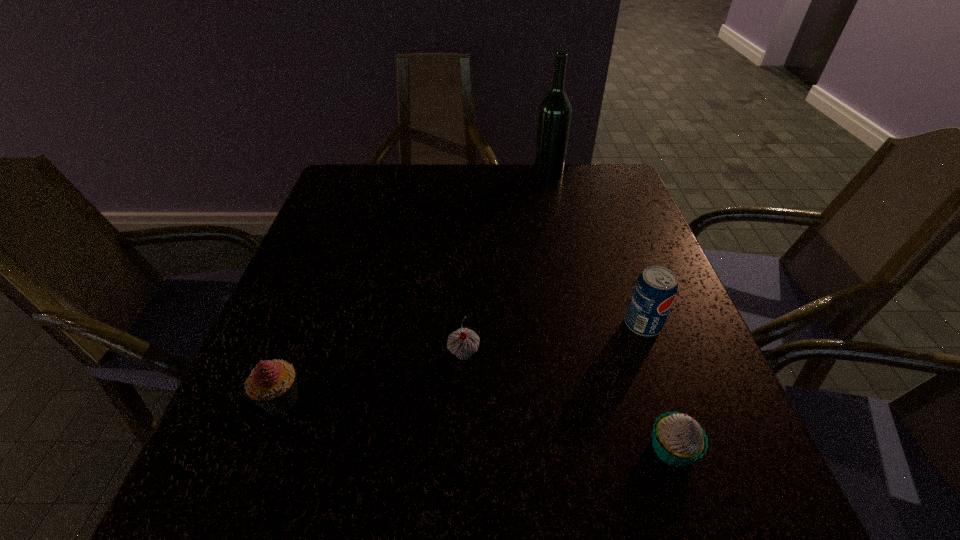
I want to click on object present at the near right corner, so click(678, 439).

Where is `free region at the far edge of the desktop`? Image resolution: width=960 pixels, height=540 pixels. free region at the far edge of the desktop is located at coordinates (405, 208).

I want to click on free space at the near edge of the desktop, so click(x=608, y=469).

In the image, there is a desktop. Identify the location of vacant space at the left edge. (373, 212).

In the image, there is a desktop. Identify the location of vacant space at the right edge. (744, 450).

Find the location of a particular element. This screenshot has width=960, height=540. vacant space at the far right corner of the desktop is located at coordinates (576, 198).

Identify the location of free space between the farthest object and the leftmost cupcake. This screenshot has height=540, width=960. (415, 285).

Locate an element on the screen. free area in between the nearest object and the farthest cupcake is located at coordinates (568, 401).

This screenshot has height=540, width=960. I want to click on free space between the third farthest object and the alcohol, so [506, 262].

Locate an element on the screen. Image resolution: width=960 pixels, height=540 pixels. free spot between the tallest object and the third farthest object is located at coordinates (506, 262).